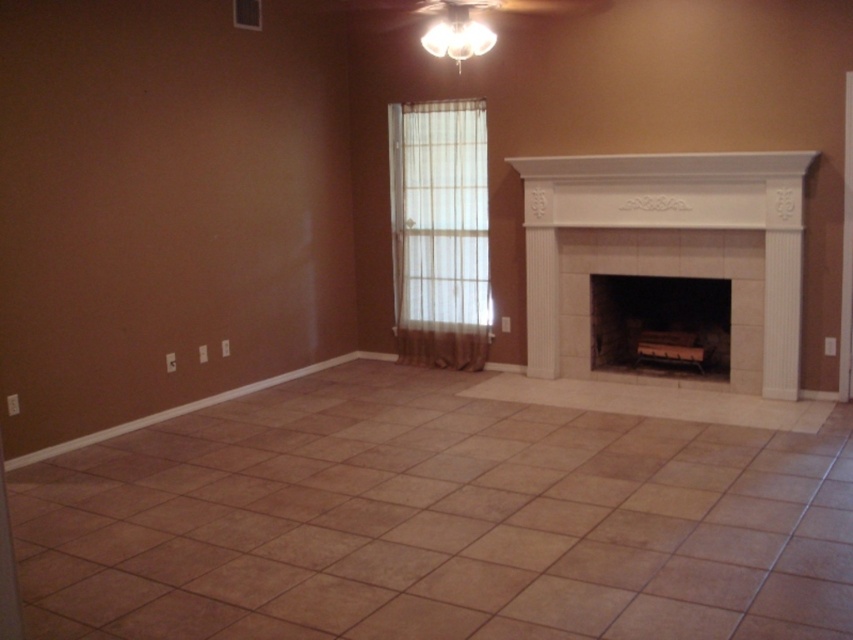
Question: Which point is farther from the camera taking this photo?

Choices:
 (A) (469, 224)
 (B) (637, 205)

Answer: (A)

Question: Can you confirm if white tile fireplace at center is positioned below white stone fireplace at center?

Choices:
 (A) no
 (B) yes

Answer: (A)

Question: Estimate the real-world distances between objects in this image. Which object is farther from the white stone fireplace at center?

Choices:
 (A) white tile fireplace at center
 (B) sheer white curtain at center

Answer: (B)

Question: Can you confirm if white tile fireplace at center is positioned to the left of white stone fireplace at center?

Choices:
 (A) no
 (B) yes

Answer: (B)

Question: Does white tile fireplace at center lie in front of white stone fireplace at center?

Choices:
 (A) no
 (B) yes

Answer: (B)

Question: Which of these objects is positioned farthest from the white tile fireplace at center?

Choices:
 (A) sheer white curtain at center
 (B) white stone fireplace at center

Answer: (A)